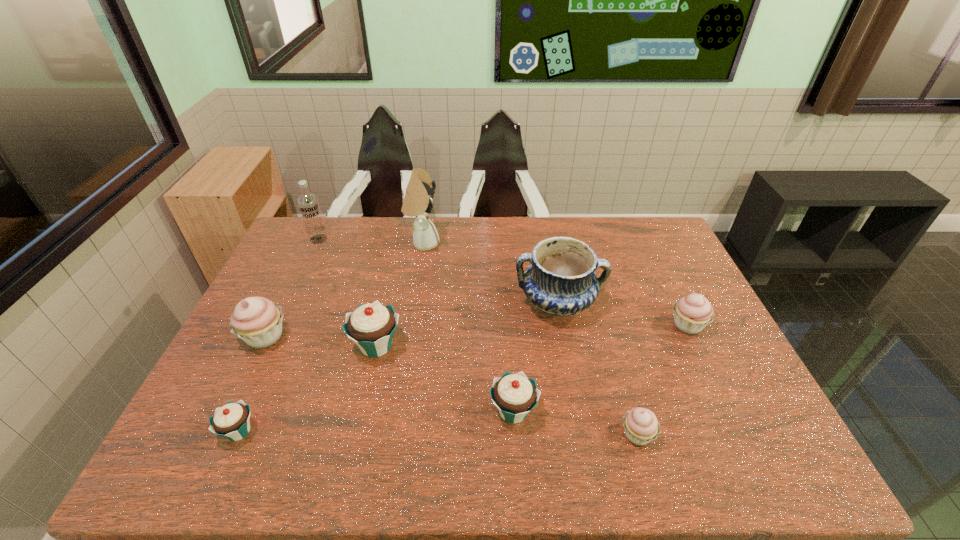
This screenshot has width=960, height=540. In order to click on unoccupied area between the pottery and the eighth shortest object in this screenshot , I will do `click(438, 271)`.

Identify the location of vacant space in between the third cupcake from left to right and the second smallest pink cupcake. The image size is (960, 540). (532, 335).

Locate an element on the screen. The width and height of the screenshot is (960, 540). free space between the fourth cupcake from left to right and the farthest teal cupcake is located at coordinates (444, 379).

The height and width of the screenshot is (540, 960). In order to click on vacant region between the leftmost teal cupcake and the black doll in this screenshot , I will do 331,337.

I want to click on free space between the biggest pink cupcake and the leftmost teal cupcake, so click(x=252, y=384).

The image size is (960, 540). In order to click on vacant space that's between the smallest pink cupcake and the smallest teal cupcake in this screenshot , I will do `click(438, 433)`.

In order to click on object that ranks as the second closest to the second biggest pink cupcake in this screenshot , I will do `click(641, 426)`.

Locate an element on the screen. The height and width of the screenshot is (540, 960). object that is the closest to the tallest object is located at coordinates (560, 280).

The height and width of the screenshot is (540, 960). I want to click on the sixth closest cupcake relative to the doll, so click(641, 426).

Identify which cupcake is located as the second nearest to the smallest teal cupcake. Please provide its 2D coordinates. Your answer should be formatted as a tuple, i.e. [(x, y)], where the tuple contains the x and y coordinates of a point satisfying the conditions above.

[(371, 326)]